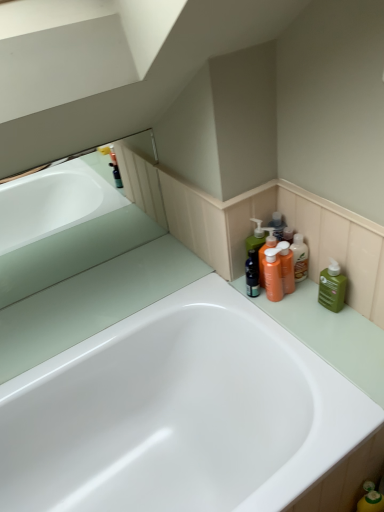
Find the location of `free space in front of orange matte pump bottle at upper right, the second cleaning product positioned from the right`. free space in front of orange matte pump bottle at upper right, the second cleaning product positioned from the right is located at coordinates (306, 329).